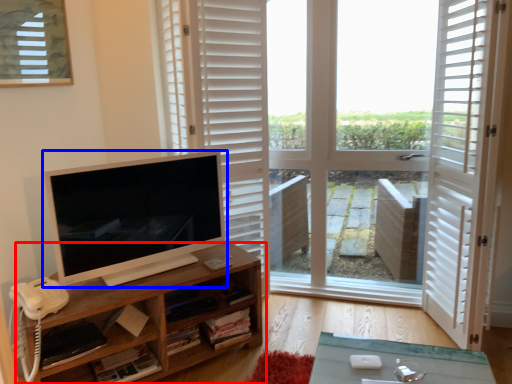
Question: Among these objects, which one is farthest to the camera, shelf (highlighted by a red box) or computer monitor (highlighted by a blue box)?

Choices:
 (A) shelf
 (B) computer monitor

Answer: (B)